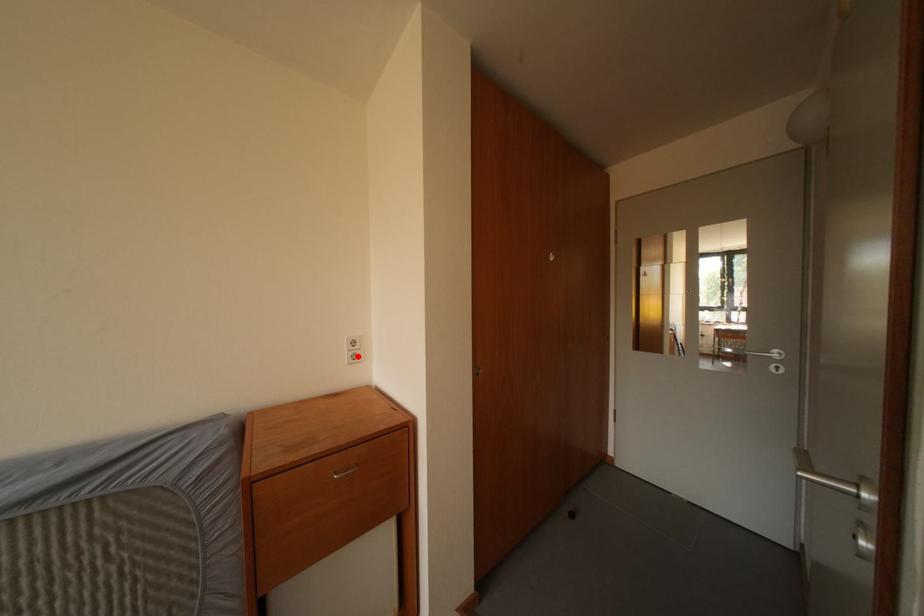
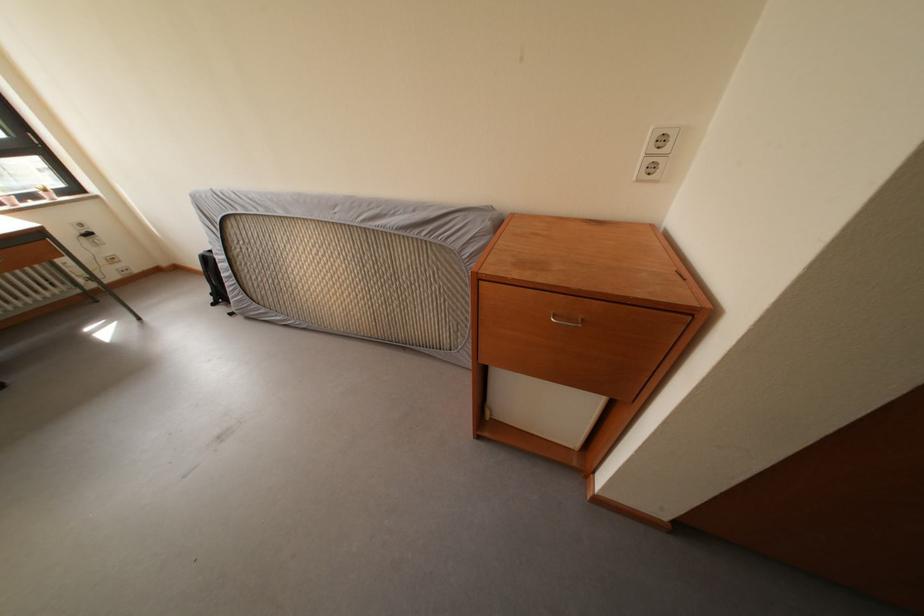
Where in the second image is the point corresponding to the highlighted location from the first image?

(657, 161)